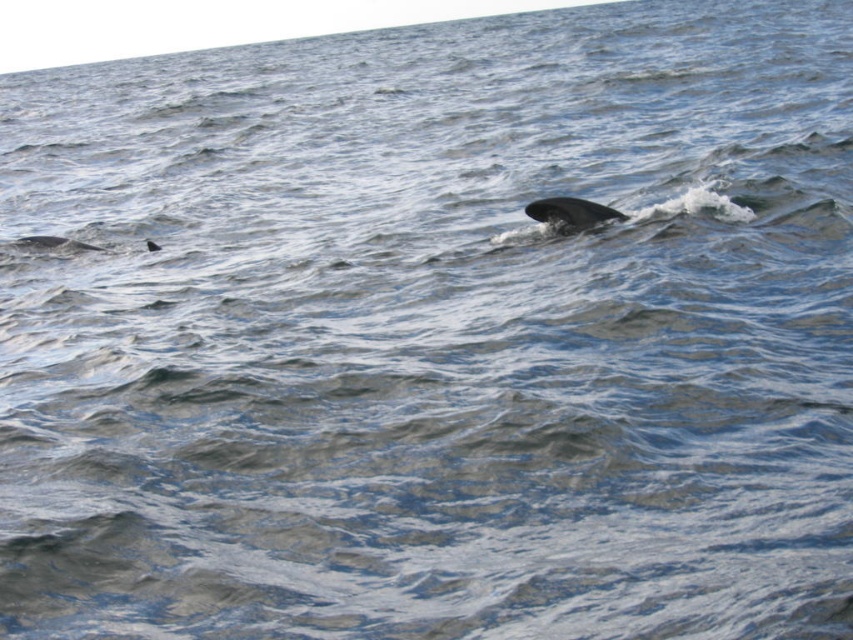
Question: Considering the relative positions of gray smooth whale at center and gray matte whale at left in the image provided, where is gray smooth whale at center located with respect to gray matte whale at left?

Choices:
 (A) right
 (B) left

Answer: (A)

Question: Does gray smooth whale at center lie behind gray matte whale at left?

Choices:
 (A) yes
 (B) no

Answer: (B)

Question: Which point is closer to the camera?

Choices:
 (A) (88, 244)
 (B) (593, 221)

Answer: (B)

Question: Where is gray smooth whale at center located in relation to gray matte whale at left in the image?

Choices:
 (A) above
 (B) below

Answer: (B)

Question: Among these points, which one is nearest to the camera?

Choices:
 (A) (19, 241)
 (B) (544, 204)

Answer: (B)